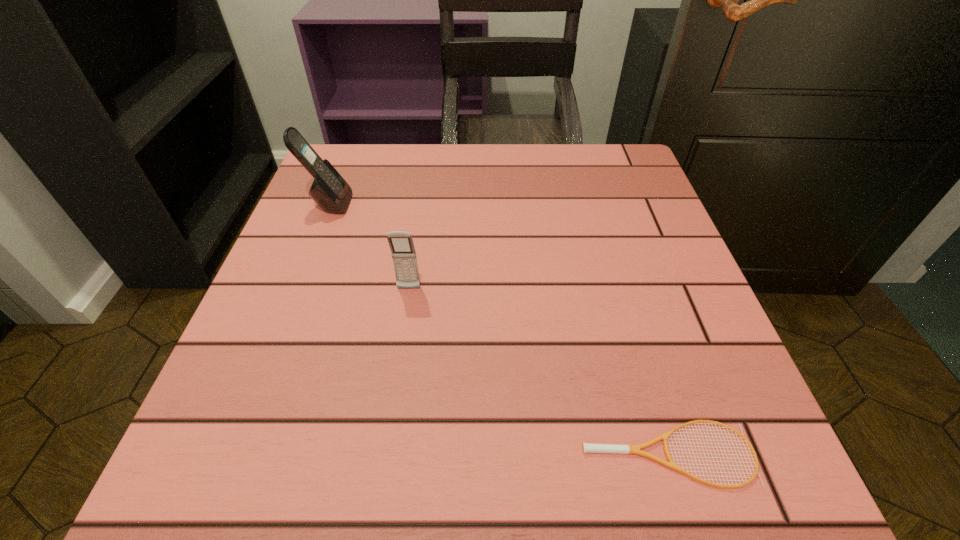
I want to click on object present at the near edge, so click(586, 447).

At what (x,y) coordinates should I click in order to perform the action: click on object situated at the left edge. Please return your answer as a coordinate pair (x, y). The width and height of the screenshot is (960, 540). Looking at the image, I should click on (329, 190).

Locate an element on the screen. The width and height of the screenshot is (960, 540). object that is at the right edge is located at coordinates (586, 447).

Locate an element on the screen. This screenshot has width=960, height=540. object situated at the far left corner is located at coordinates (329, 190).

I want to click on object at the near right corner, so click(586, 447).

In the image, there is a desktop. Where is `free region at the far edge`? free region at the far edge is located at coordinates (441, 150).

The image size is (960, 540). In order to click on free space at the near edge of the desktop in this screenshot , I will do `click(508, 497)`.

In the image, there is a desktop. Identify the location of free space at the left edge. (292, 335).

The height and width of the screenshot is (540, 960). Find the location of `vacant space at the right edge`. vacant space at the right edge is located at coordinates (647, 248).

The width and height of the screenshot is (960, 540). What are the coordinates of `free space at the far left corner` in the screenshot? It's located at (349, 156).